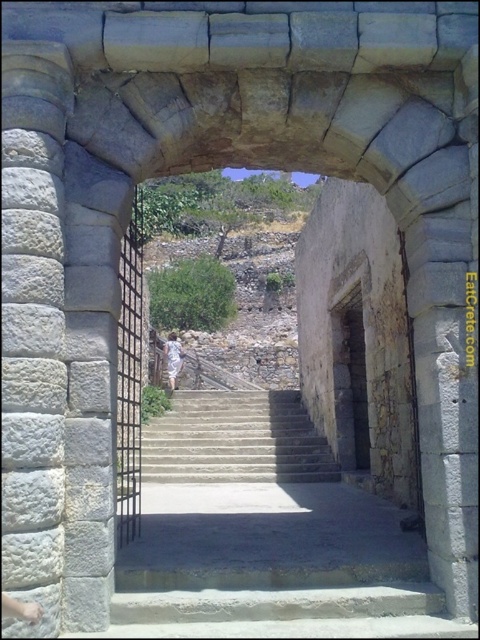
Does black metal gate at left have a greater width compared to rustic stone doorway at center?

Indeed, black metal gate at left has a greater width compared to rustic stone doorway at center.

Does black metal gate at left have a smaller size compared to rustic stone doorway at center?

No, black metal gate at left is not smaller than rustic stone doorway at center.

Between point (132, 243) and point (361, 420), which one is positioned behind?

The point (361, 420) is behind.

The height and width of the screenshot is (640, 480). I want to click on black metal gate at left, so click(130, 384).

Can you confirm if white stone pillar at left is smaller than rustic stone doorway at center?

Yes, white stone pillar at left is smaller than rustic stone doorway at center.

Measure the distance between point [49,428] and camera.

Point [49,428] is 13.04 meters from camera.

Where is `white stone pillar at left`? The width and height of the screenshot is (480, 640). white stone pillar at left is located at coordinates (33, 316).

Measure the distance from smooth stone stairs at center to black metal gate at left.

The distance of smooth stone stairs at center from black metal gate at left is 6.49 meters.

Find the location of a particular element. The width and height of the screenshot is (480, 640). smooth stone stairs at center is located at coordinates (236, 440).

You are a GUI agent. You are given a task and a screenshot of the screen. Output one action in this format:
    pyautogui.click(x=<x>, y=<y>)
    Task: Click on the smooth stone stairs at center
    The image size is (480, 640).
    Given the screenshot: What is the action you would take?
    pyautogui.click(x=236, y=440)